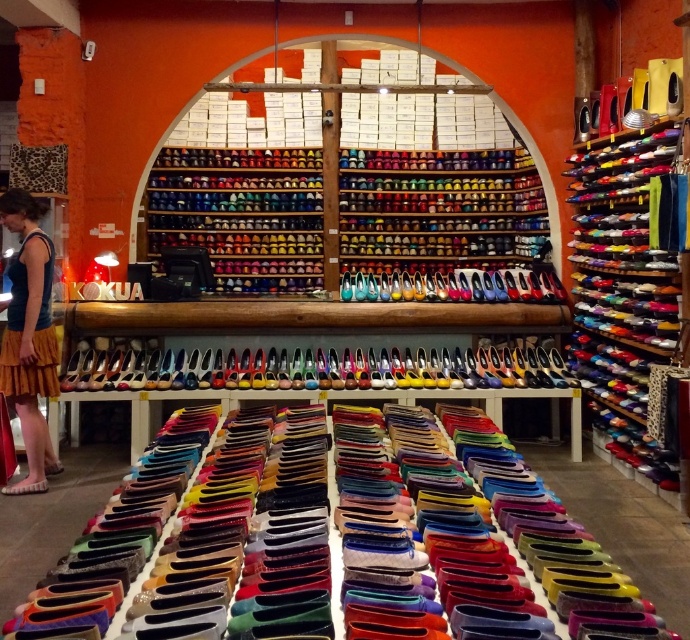
You are a customer in the shoe store and you want to see the yellow textured skirt at lower left and the wooden table at center. Which object is higher in height?

The yellow textured skirt at lower left is taller than the wooden table at center.